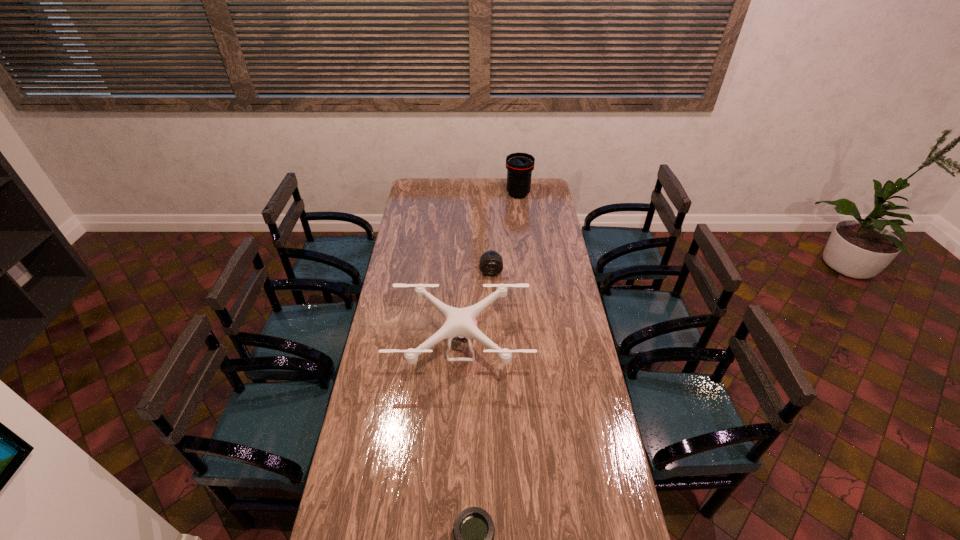
Find the location of a particular element. the rightmost telephoto lens is located at coordinates (519, 166).

The height and width of the screenshot is (540, 960). I want to click on the farthest telephoto lens, so pyautogui.click(x=519, y=166).

The width and height of the screenshot is (960, 540). Identify the location of the third farthest object. (459, 323).

The image size is (960, 540). I want to click on drone, so click(459, 323).

The height and width of the screenshot is (540, 960). In order to click on the third tallest object in this screenshot , I will do `click(491, 263)`.

Locate an element on the screen. The height and width of the screenshot is (540, 960). the second nearest telephoto lens is located at coordinates (491, 263).

You are a GUI agent. You are given a task and a screenshot of the screen. Output one action in this format:
    pyautogui.click(x=<x>, y=<y>)
    Task: Click on the vacant space located on the left of the rightmost telephoto lens
    
    Given the screenshot: What is the action you would take?
    pyautogui.click(x=439, y=194)

Where is `vacant space located on the top of the second nearest object`? This screenshot has height=540, width=960. vacant space located on the top of the second nearest object is located at coordinates (457, 458).

Where is `vacant space located 0.320m on the front-facing side of the second shortest object`? This screenshot has width=960, height=540. vacant space located 0.320m on the front-facing side of the second shortest object is located at coordinates (492, 328).

What are the coordinates of `object situated at the far edge` in the screenshot? It's located at [519, 166].